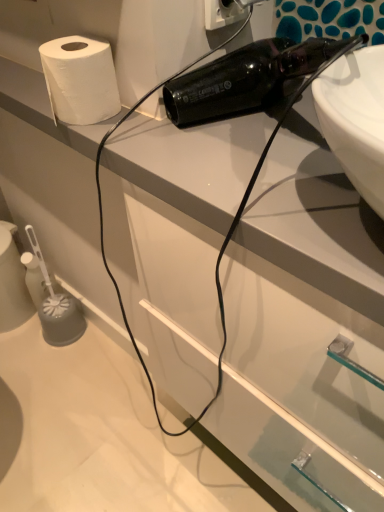
Question: From the image's perspective, is white plastic electric outlet at upper center located above or below white matte paper towel at upper left?

Choices:
 (A) below
 (B) above

Answer: (B)

Question: Is white plastic electric outlet at upper center situated inside white matte paper towel at upper left or outside?

Choices:
 (A) outside
 (B) inside

Answer: (A)

Question: Relative to white matte paper towel at upper left, is white plastic electric outlet at upper center in front or behind?

Choices:
 (A) front
 (B) behind

Answer: (A)

Question: In the image, is white matte paper towel at upper left positioned in front of or behind white plastic electric outlet at upper center?

Choices:
 (A) behind
 (B) front

Answer: (A)

Question: Is white matte paper towel at upper left to the left or to the right of white plastic electric outlet at upper center in the image?

Choices:
 (A) right
 (B) left

Answer: (B)

Question: Does point (64, 96) appear closer or farther from the camera than point (241, 13)?

Choices:
 (A) closer
 (B) farther

Answer: (A)

Question: From a real-world perspective, relative to white plastic electric outlet at upper center, is white matte paper towel at upper left vertically above or below?

Choices:
 (A) below
 (B) above

Answer: (A)